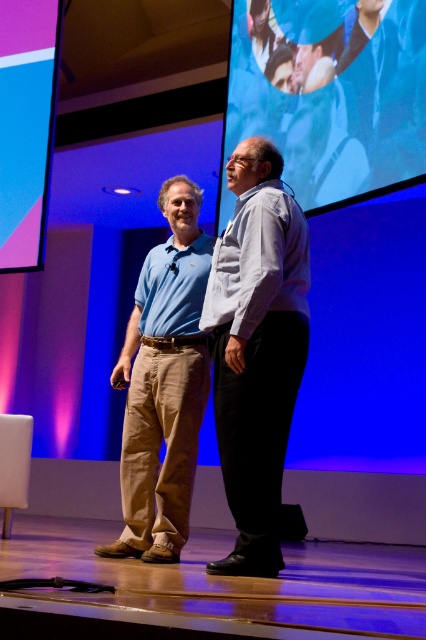
This screenshot has height=640, width=426. What do you see at coordinates (331, 92) in the screenshot?
I see `blue fabric at upper center` at bounding box center [331, 92].

Can you confirm if blue fabric at upper center is positioned below light blue shirt at center?

No, blue fabric at upper center is not below light blue shirt at center.

Between point (403, 33) and point (271, 458), which one is positioned behind?

The point (403, 33) is behind.

The image size is (426, 640). I want to click on blue fabric at upper center, so click(x=331, y=92).

Is point (264, 355) positioned after point (176, 360)?

No, it is not.

Between light blue shirt at center and matte blue shirt at center, which one has less height?

With less height is light blue shirt at center.

Where is `light blue shirt at center`? light blue shirt at center is located at coordinates (256, 349).

Locate an element on the screen. light blue shirt at center is located at coordinates (256, 349).

Does blue fabric at upper center appear on the right side of matte blue shirt at center?

Indeed, blue fabric at upper center is positioned on the right side of matte blue shirt at center.

Based on the photo, does blue fabric at upper center have a smaller size compared to matte blue shirt at center?

No, blue fabric at upper center is not smaller than matte blue shirt at center.

Who is more forward, (350, 124) or (169, 330)?

Point (169, 330) is more forward.

This screenshot has width=426, height=640. What are the coordinates of `blue fabric at upper center` in the screenshot? It's located at (331, 92).